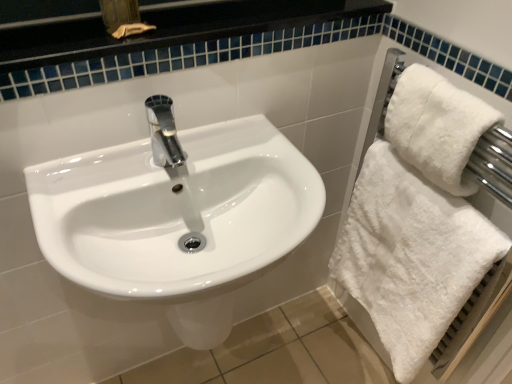
Question: From the image's perspective, is white fluffy towel at right located above or below white glossy sink at center?

Choices:
 (A) above
 (B) below

Answer: (A)

Question: Is point (414, 125) positioned closer to the camera than point (254, 266)?

Choices:
 (A) farther
 (B) closer

Answer: (A)

Question: Which object is positioned closest to the white fluffy towel at right?

Choices:
 (A) white glossy sink at center
 (B) white fluffy towel at right

Answer: (B)

Question: Estimate the real-world distances between objects in this image. Which object is farther from the white fluffy towel at right?

Choices:
 (A) white glossy sink at center
 (B) white fluffy towel at right

Answer: (A)